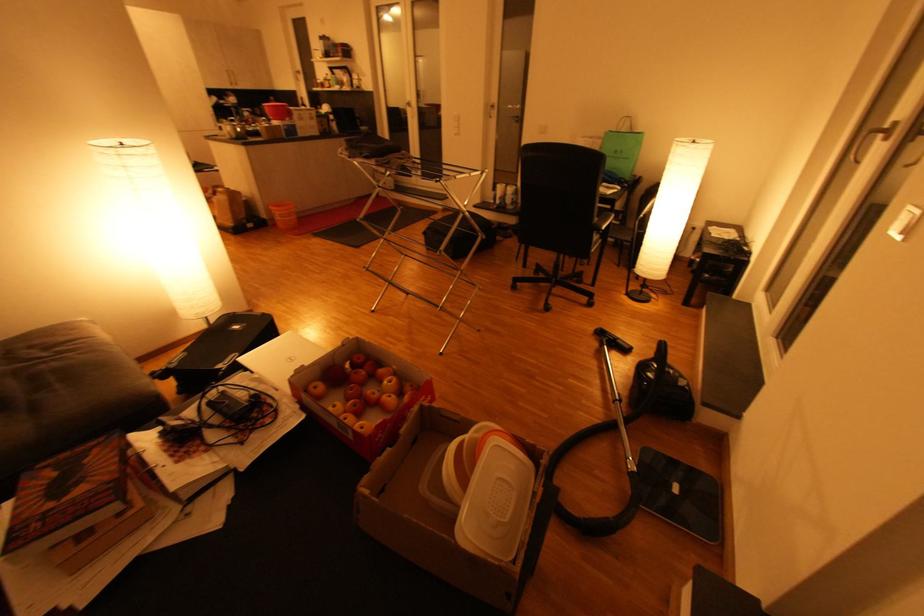
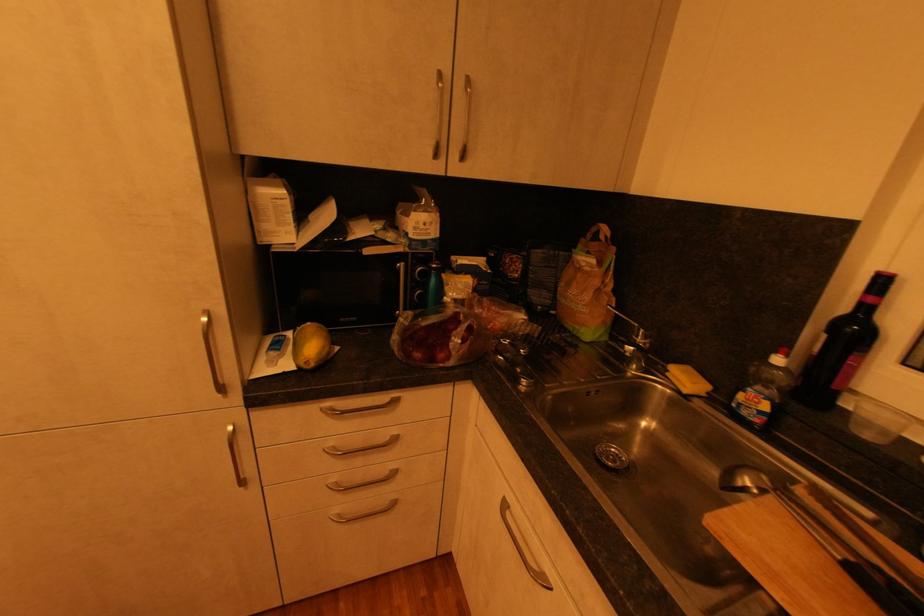
Where in the second image is the point corresponding to point 308,100 from the first image?

(889, 282)